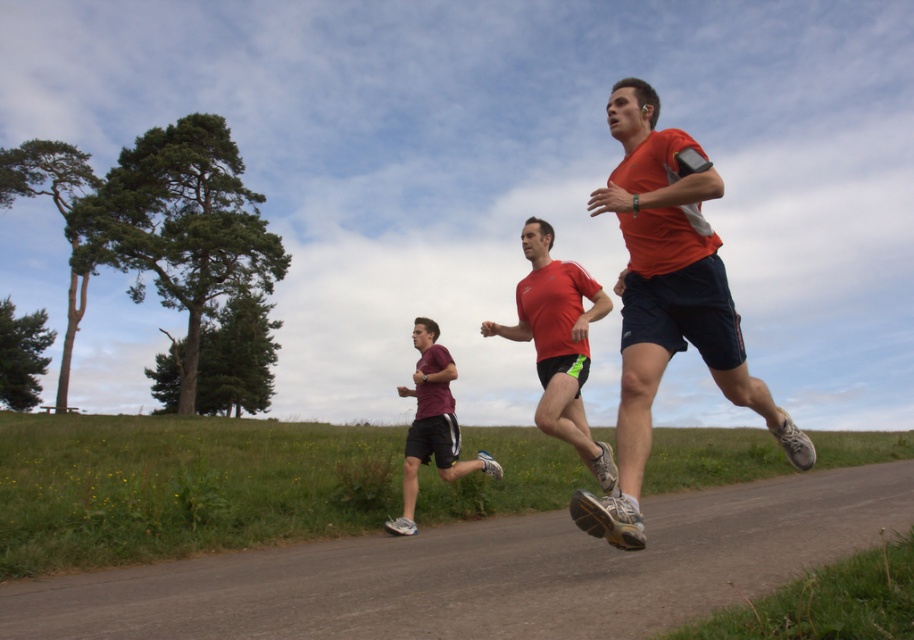
You are a photographer trying to capture a photo of the matte red shirt at center and the maroon fabric shorts at center. Which object should you zoom in on to focus on the smaller one?

The matte red shirt at center occupies less space than maroon fabric shorts at center, so you should zoom in on the matte red shirt at center to focus on the smaller one.